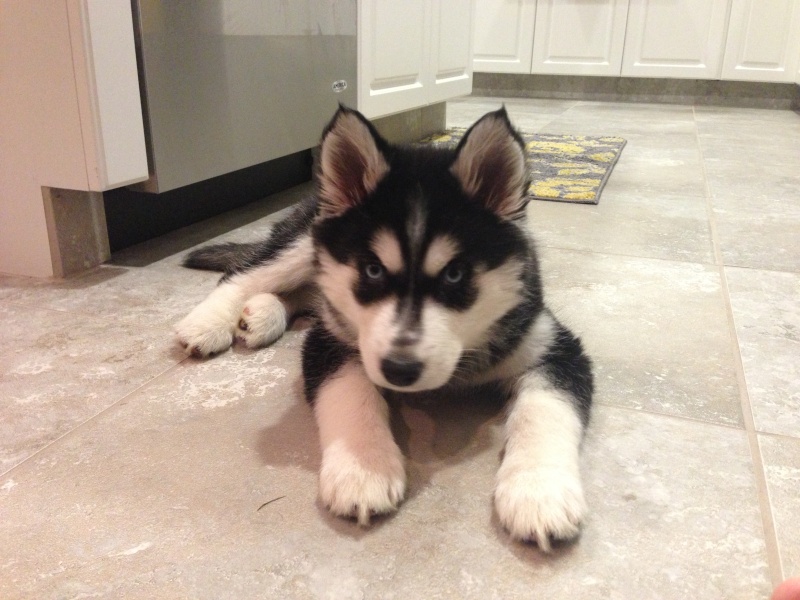
I want to click on cabinet, so click(758, 34), click(681, 20), click(569, 32), click(510, 23), click(458, 46), click(405, 52).